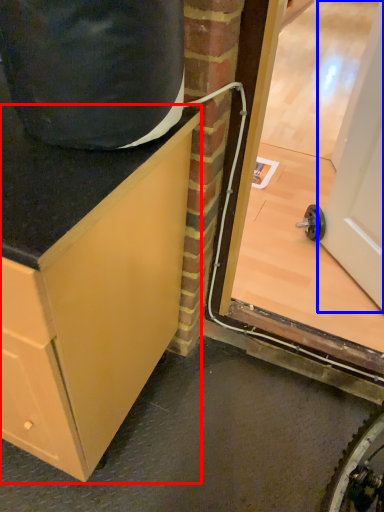
Question: Among these objects, which one is farthest to the camera, cabinetry (highlighted by a red box) or door (highlighted by a blue box)?

Choices:
 (A) cabinetry
 (B) door

Answer: (B)